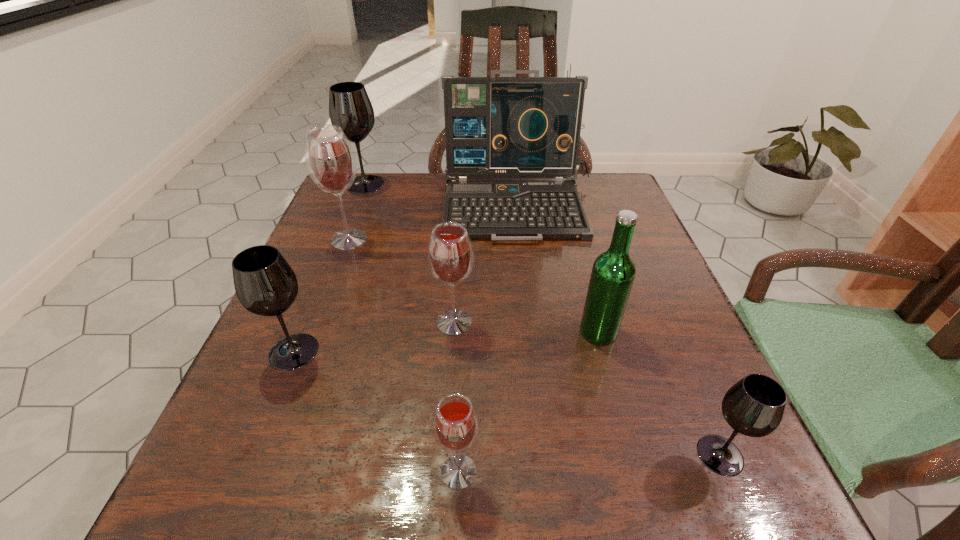
Find the location of `wineglass positioned at the far edge`. wineglass positioned at the far edge is located at coordinates (350, 108).

This screenshot has height=540, width=960. Find the location of `laptop computer that is at the right edge`. laptop computer that is at the right edge is located at coordinates (495, 127).

Find the location of a particular element. Image resolution: width=960 pixels, height=540 pixels. beer bottle that is at the right edge is located at coordinates point(613,272).

Locate an element on the screen. This screenshot has height=540, width=960. wineglass that is at the right edge is located at coordinates (754, 406).

The width and height of the screenshot is (960, 540). I want to click on object present at the far left corner, so click(350, 108).

Locate an element on the screen. The width and height of the screenshot is (960, 540). object positioned at the far right corner is located at coordinates (495, 127).

Locate an element on the screen. This screenshot has width=960, height=540. object that is at the near right corner is located at coordinates (754, 406).

The image size is (960, 540). What are the coordinates of `free region at the far edge of the desktop` in the screenshot? It's located at (395, 212).

The width and height of the screenshot is (960, 540). Identify the location of vacant region at the near edge of the desktop. (467, 521).

Identify the location of vacant space at the left edge of the desktop. Image resolution: width=960 pixels, height=540 pixels. (308, 301).